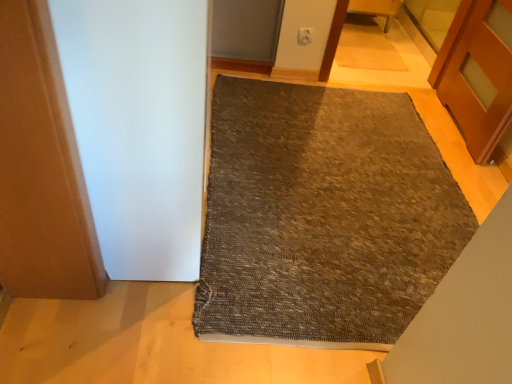
Question: Visually, is white matte screen door at left positioned to the left or to the right of textured gray mat at center?

Choices:
 (A) right
 (B) left

Answer: (B)

Question: Is point (106, 92) closer or farther from the camera than point (285, 187)?

Choices:
 (A) closer
 (B) farther

Answer: (A)

Question: Considering the real-world distances, which object is farthest from the textured gray mat at center?

Choices:
 (A) wooden door at right
 (B) white matte screen door at left
 (C) wooden chair at upper center

Answer: (C)

Question: Based on their relative distances, which object is nearer to the wooden chair at upper center?

Choices:
 (A) wooden door at right
 (B) textured gray mat at center
 (C) white matte screen door at left

Answer: (A)